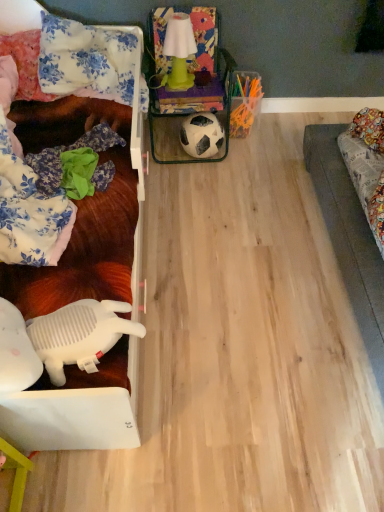
At what (x,y) coordinates should I click in order to perform the action: click on free space to the left of white matte football at center. Please return your answer as a coordinate pair (x, y). The image size is (384, 512). Looking at the image, I should click on (165, 154).